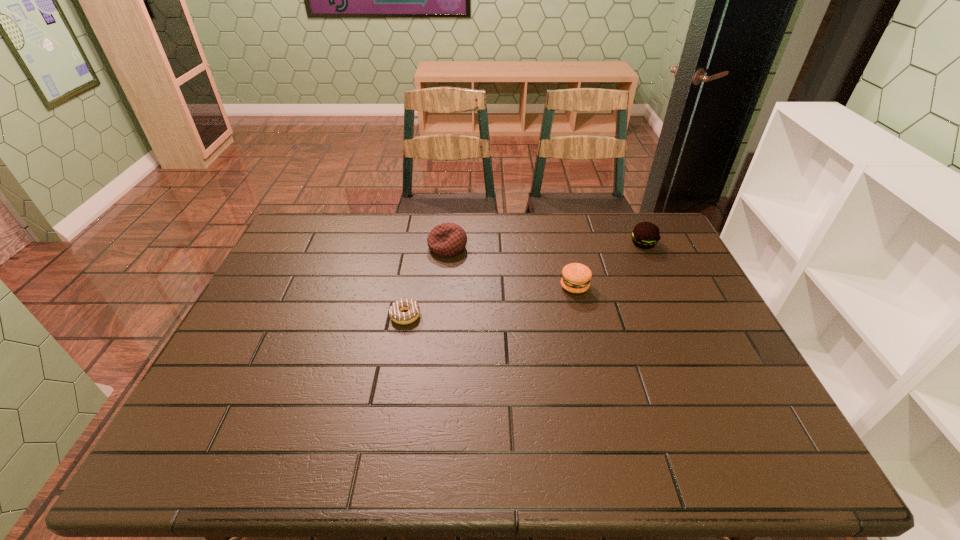
Find the location of `vacant space that is in between the nearer patty and the beanbag`. vacant space that is in between the nearer patty and the beanbag is located at coordinates (511, 267).

You are a GUI agent. You are given a task and a screenshot of the screen. Output one action in this format:
    pyautogui.click(x=<x>, y=<y>)
    Task: Click on the object that is the second closest to the shortest object
    
    Given the screenshot: What is the action you would take?
    pyautogui.click(x=576, y=277)

Select which object appears as the third closest to the shortest object. Please provide its 2D coordinates. Your answer should be formatted as a tuple, i.e. [(x, y)], where the tuple contains the x and y coordinates of a point satisfying the conditions above.

[(645, 235)]

Find the location of a particular element. vacant space that satisfies the following two spatial constraints: 1. on the front side of the beanbag; 2. on the left side of the left patty is located at coordinates (444, 287).

The image size is (960, 540). I want to click on vacant space that satisfies the following two spatial constraints: 1. on the back side of the nearer patty; 2. on the right side of the shortest object, so click(411, 287).